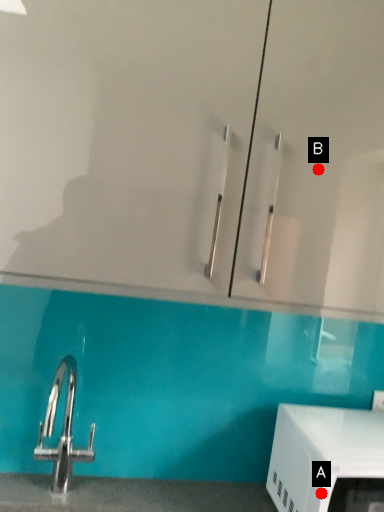
Question: Two points are circled on the image, labeled by A and B beside each circle. Which point is closer to the camera?

Choices:
 (A) A is closer
 (B) B is closer

Answer: (B)